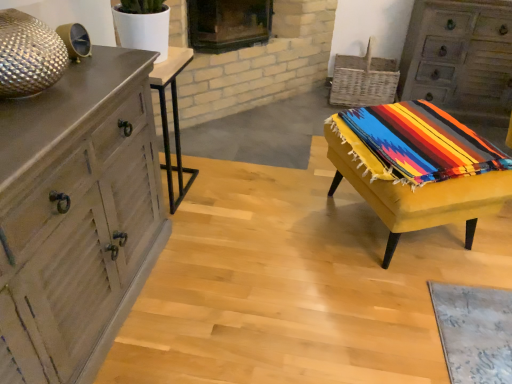
This screenshot has height=384, width=512. I want to click on free space in front of yellow fabric-covered stool at right, which is the 2th table from left to right, so click(407, 321).